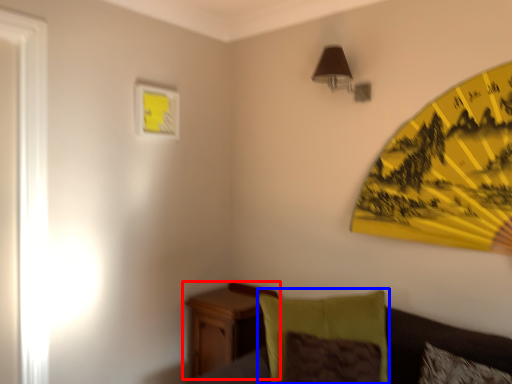
Question: Which object appears closest to the camera in this image, nightstand (highlighted by a red box) or pillow (highlighted by a blue box)?

Choices:
 (A) nightstand
 (B) pillow

Answer: (B)